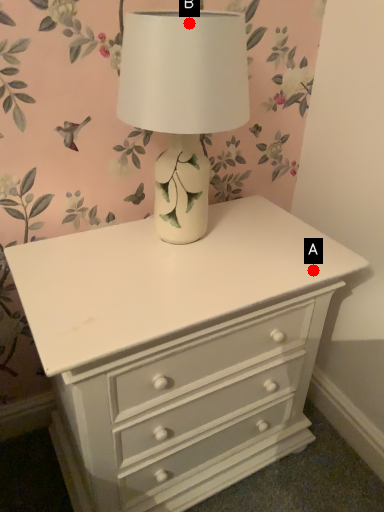
Question: Two points are circled on the image, labeled by A and B beside each circle. Among these points, which one is nearest to the camera?

Choices:
 (A) A is closer
 (B) B is closer

Answer: (B)